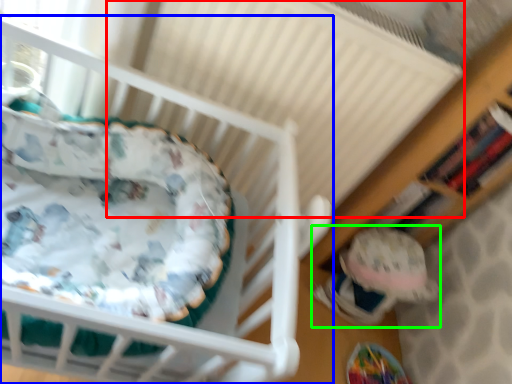
Question: Based on their relative distances, which object is farther from radiator (highlighted by a red box)? Choose from infant bed (highlighted by a blue box) and toy (highlighted by a green box).

Choices:
 (A) infant bed
 (B) toy

Answer: (B)